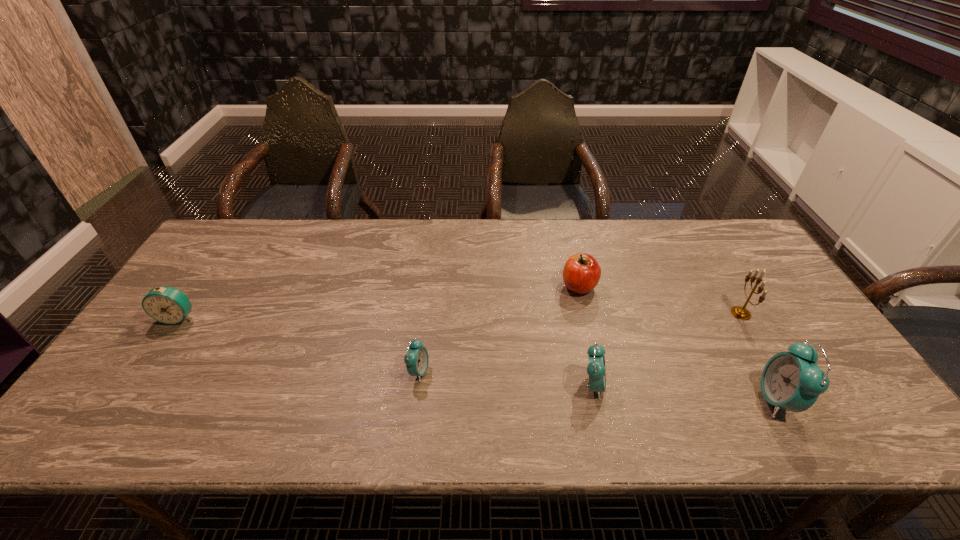
Identify the location of vacant area between the farthest alarm clock and the candelabrum. (460, 315).

You are a GUI agent. You are given a task and a screenshot of the screen. Output one action in this format:
    pyautogui.click(x=<x>, y=<y>)
    Task: Click on the vacant space that's between the leftmost alarm clock and the candelabrum
    
    Given the screenshot: What is the action you would take?
    pyautogui.click(x=460, y=315)

Locate an element on the screen. vacant area that lies between the apple and the second object from left to right is located at coordinates (499, 329).

This screenshot has width=960, height=540. What are the coordinates of `vacant area that lies between the candelabrum and the tallest alarm clock` in the screenshot? It's located at (759, 356).

Where is `free spot between the candelabrum and the apple`? The image size is (960, 540). free spot between the candelabrum and the apple is located at coordinates (660, 300).

Image resolution: width=960 pixels, height=540 pixels. Find the location of `object that is the second closest to the candelabrum`. object that is the second closest to the candelabrum is located at coordinates (581, 274).

Choose which object is the fourth nearest neighbor to the rightmost alarm clock. Please provide its 2D coordinates. Your answer should be formatted as a tuple, i.e. [(x, y)], where the tuple contains the x and y coordinates of a point satisfying the conditions above.

[(417, 359)]

Locate an element on the screen. alarm clock object that ranks as the closest to the third alarm clock from left to right is located at coordinates click(793, 381).

Find the location of `the second closest alarm clock to the third alarm clock from right to left`. the second closest alarm clock to the third alarm clock from right to left is located at coordinates (168, 305).

Locate an element on the screen. The image size is (960, 540). free space in the image that satisfies the following two spatial constraints: 1. on the front side of the candelabrum; 2. on the face of the shortest alarm clock is located at coordinates (776, 372).